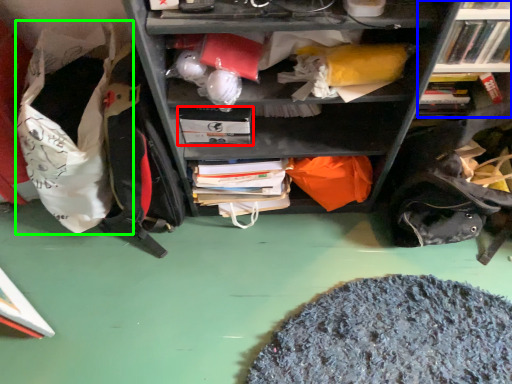
Question: Based on their relative distances, which object is nearer to paperback book (highlighted by a red box)? Choose from bookcase (highlighted by a blue box) and bean bag chair (highlighted by a green box).

Choices:
 (A) bookcase
 (B) bean bag chair

Answer: (B)